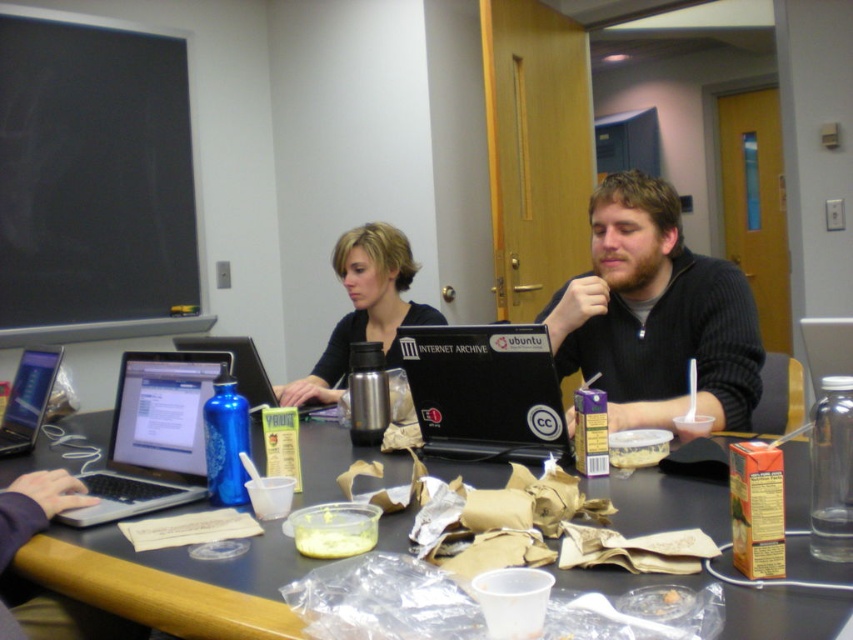
Who is taller, black matte laptop at center or black matte shirt at center?

Standing taller between the two is black matte shirt at center.

Can you confirm if black matte laptop at center is positioned below black matte shirt at center?

Indeed, black matte laptop at center is positioned under black matte shirt at center.

Is point (534, 433) positioned behind point (393, 296)?

No, it is in front of (393, 296).

Locate an element on the screen. The image size is (853, 640). black matte laptop at center is located at coordinates (485, 392).

Between black matte shirt at center and brushed metal thermos at center, which one is positioned lower?

Positioned lower is brushed metal thermos at center.

Can you confirm if black matte shirt at center is smaller than brushed metal thermos at center?

No, black matte shirt at center is not smaller than brushed metal thermos at center.

Locate an element on the screen. This screenshot has height=640, width=853. black matte shirt at center is located at coordinates (364, 308).

Does point (728, 328) come closer to viewer compared to point (544, 442)?

No, (728, 328) is further to viewer.

Is dark gray sweater at center taller than black matte laptop at center?

Indeed, dark gray sweater at center has a greater height compared to black matte laptop at center.

Is point (631, 269) less distant than point (410, 381)?

No, (631, 269) is behind (410, 381).

This screenshot has height=640, width=853. What are the coordinates of `dark gray sweater at center` in the screenshot? It's located at (654, 314).